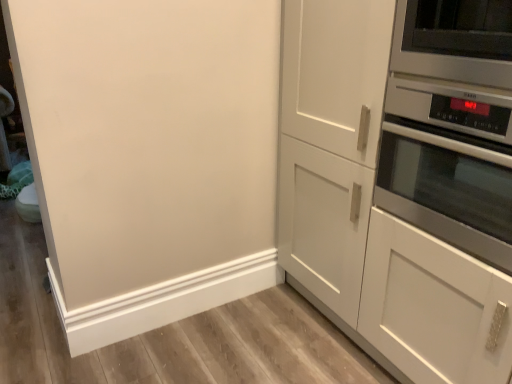
Question: Considering the positions of stainless steel oven at right and satin silver microwave at upper right in the image, is stainless steel oven at right wider or thinner than satin silver microwave at upper right?

Choices:
 (A) wide
 (B) thin

Answer: (A)

Question: Based on their sizes in the image, would you say stainless steel oven at right is bigger or smaller than satin silver microwave at upper right?

Choices:
 (A) small
 (B) big

Answer: (B)

Question: Estimate the real-world distances between objects in this image. Which object is farther from the stainless steel oven at right?

Choices:
 (A) white matte cabinet at right
 (B) satin silver microwave at upper right

Answer: (A)

Question: Estimate the real-world distances between objects in this image. Which object is closer to the satin silver microwave at upper right?

Choices:
 (A) white matte cabinet at right
 (B) stainless steel oven at right

Answer: (B)